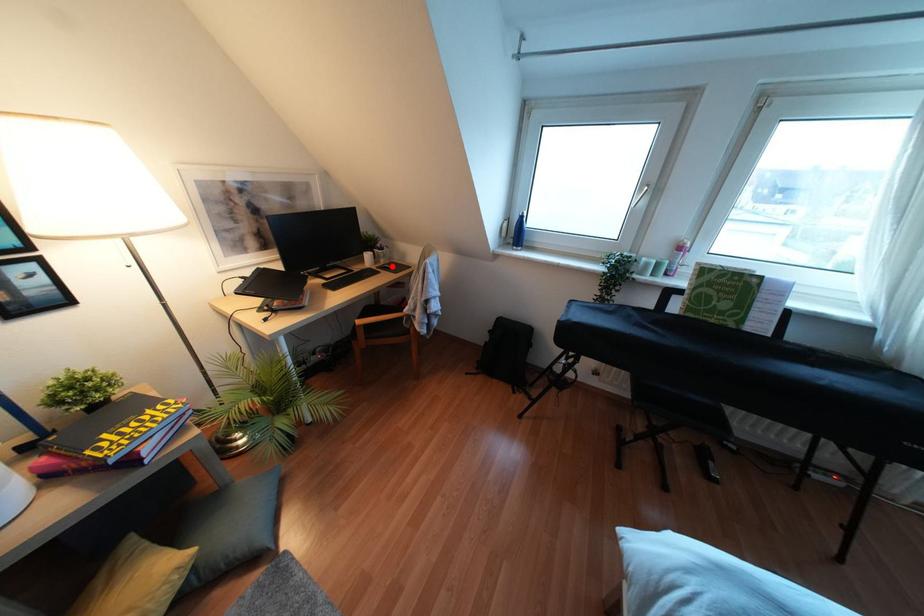
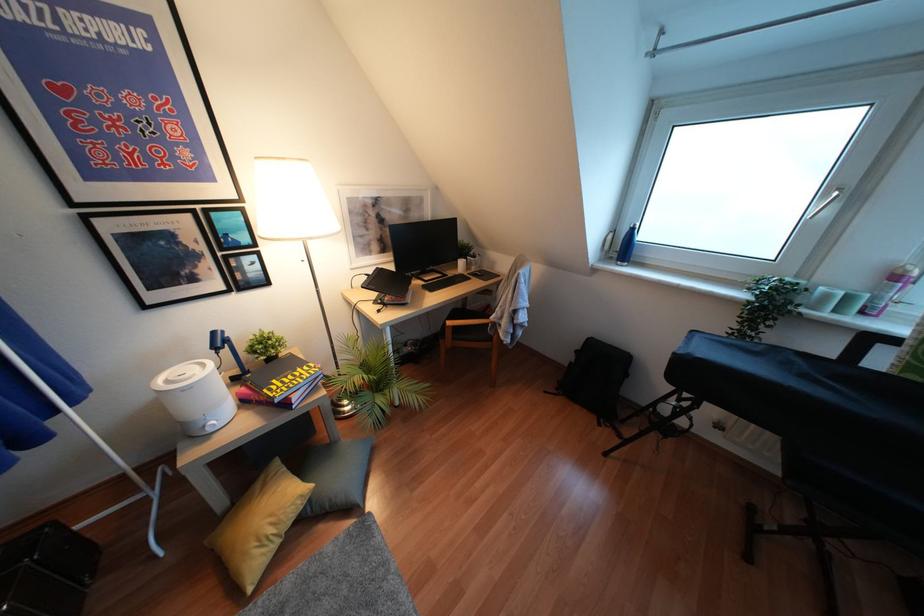
Find the pixel in the second image that matches the highlighted location in the first image.

(481, 274)